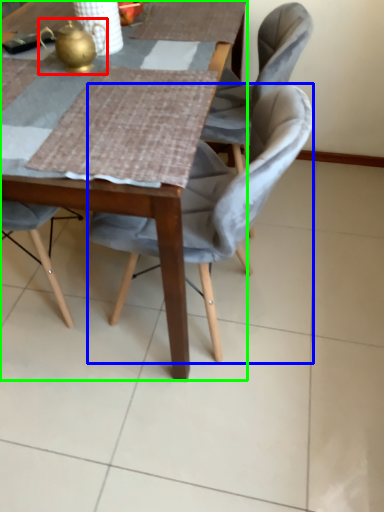
Question: Which object is positioned farthest from tea pot (highlighted by a red box)? Select from chair (highlighted by a blue box) and table (highlighted by a green box).

Choices:
 (A) chair
 (B) table

Answer: (B)